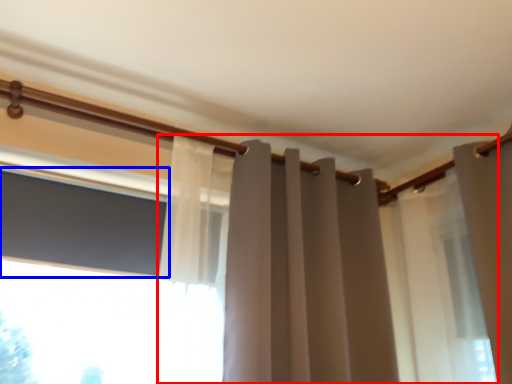
Question: Which point is further to the camera, curtain (highlighted by a red box) or window screen (highlighted by a blue box)?

Choices:
 (A) curtain
 (B) window screen

Answer: (B)